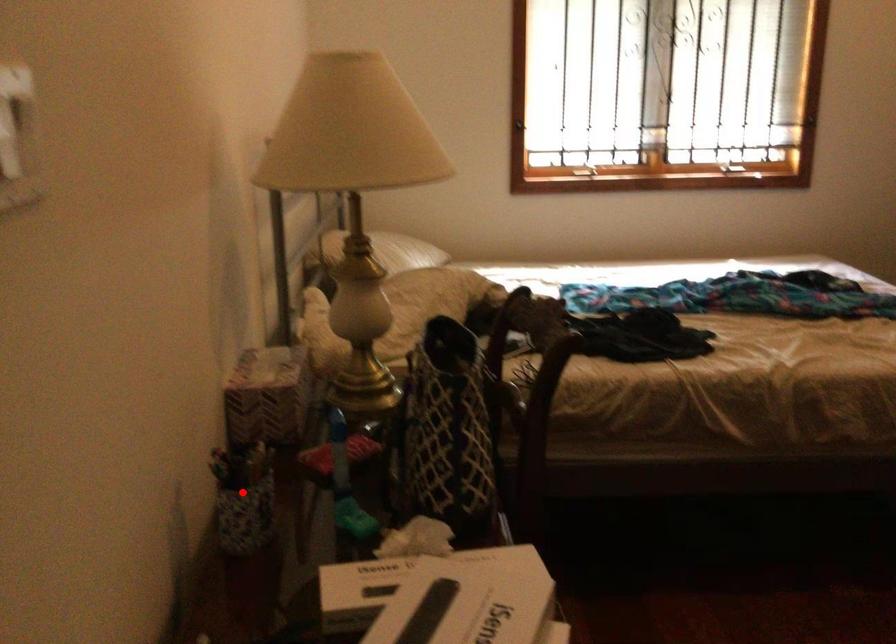
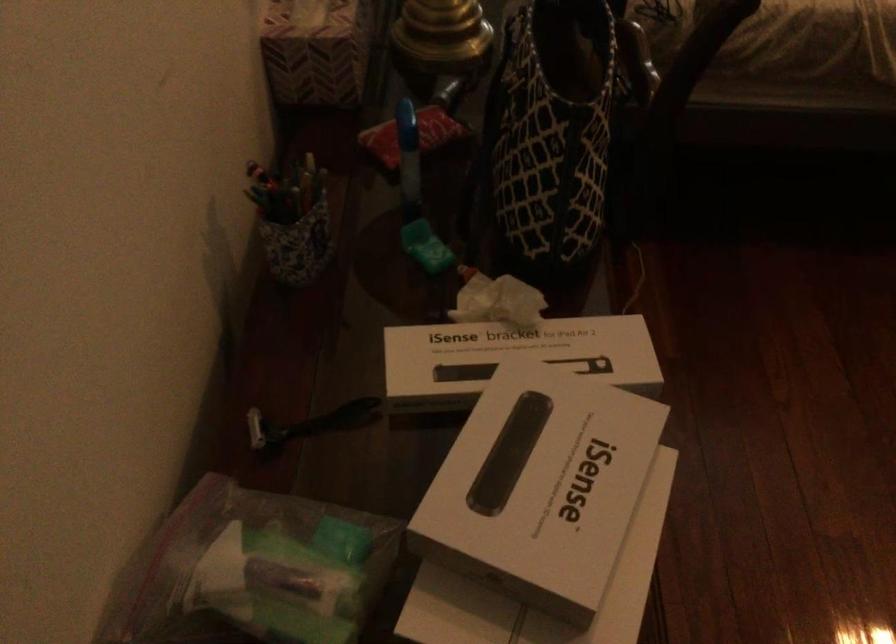
Find the pixel in the second image that matches the highlighted location in the first image.

(291, 220)